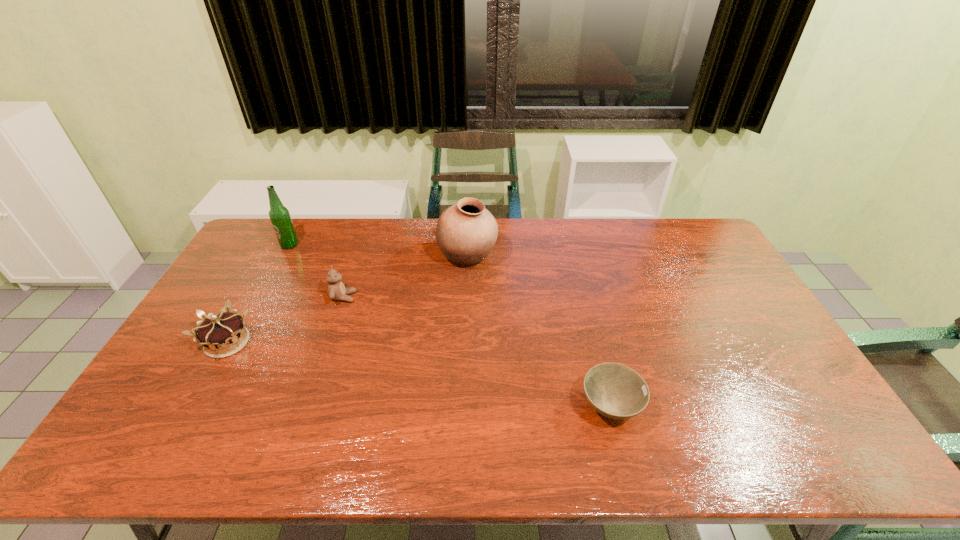
At what (x,y) coordinates should I click in order to perform the action: click on free point between the crown and the beer bottle. Please return your answer as a coordinate pair (x, y). Looking at the image, I should click on (258, 294).

Find the location of a particular element. vacant point located between the beer bottle and the crown is located at coordinates (258, 294).

In order to click on object that stands as the closest to the crown in this screenshot , I will do `click(337, 291)`.

Find the location of a particular element. the third closest object to the crown is located at coordinates (466, 232).

At what (x,y) coordinates should I click in order to perform the action: click on free space that satisfies the following two spatial constraints: 1. on the front-facing side of the teddy bear; 2. on the left side of the nearest object. Please return your answer as a coordinate pair (x, y). Looking at the image, I should click on (306, 407).

You are a GUI agent. You are given a task and a screenshot of the screen. Output one action in this format:
    pyautogui.click(x=<x>, y=<y>)
    Task: Click on the free space that satisfies the following two spatial constraints: 1. on the label of the pottery; 2. on the right side of the beer bottle
    
    Given the screenshot: What is the action you would take?
    pyautogui.click(x=283, y=258)